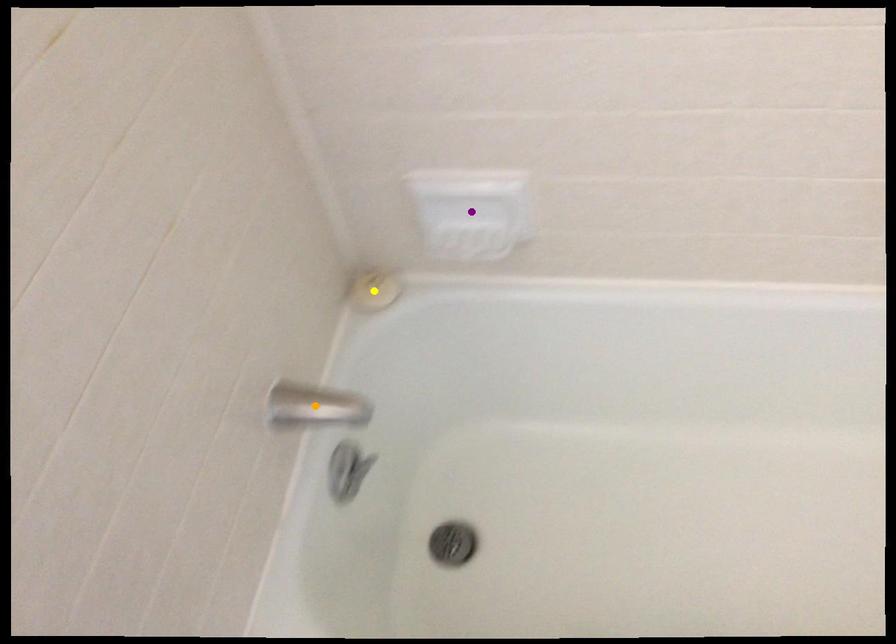
Order these from nearest to farthest:
1. purple point
2. orange point
3. yellow point

yellow point
purple point
orange point